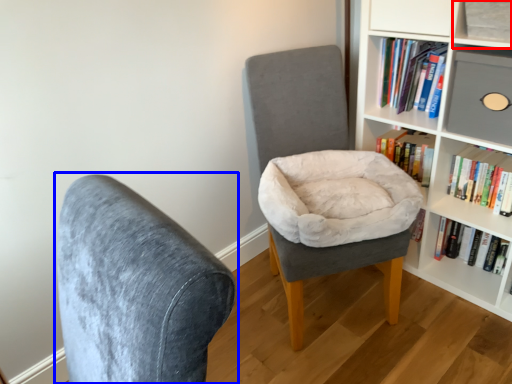
Question: Which of the following is the closest to the observer, shelf (highlighted by a red box) or chair (highlighted by a blue box)?

Choices:
 (A) shelf
 (B) chair

Answer: (B)